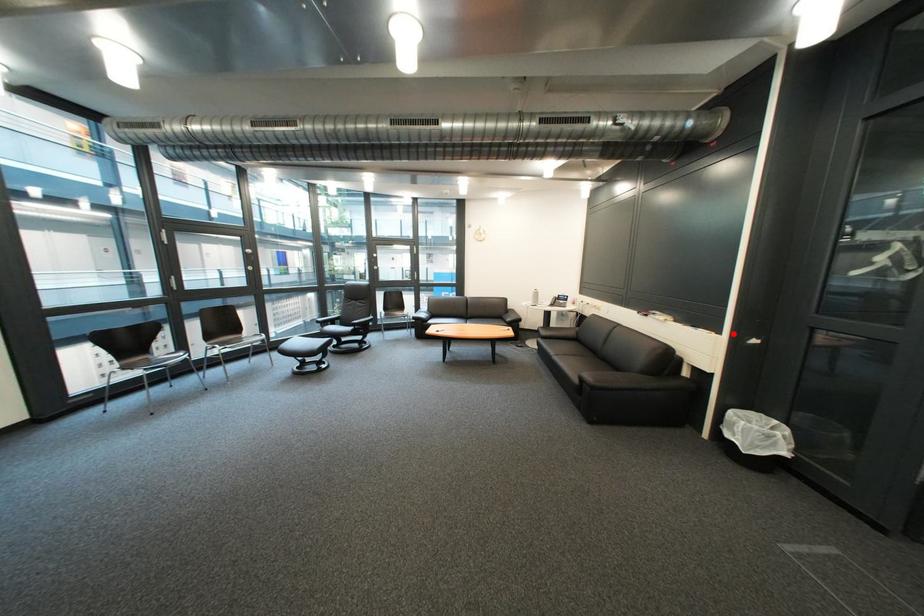
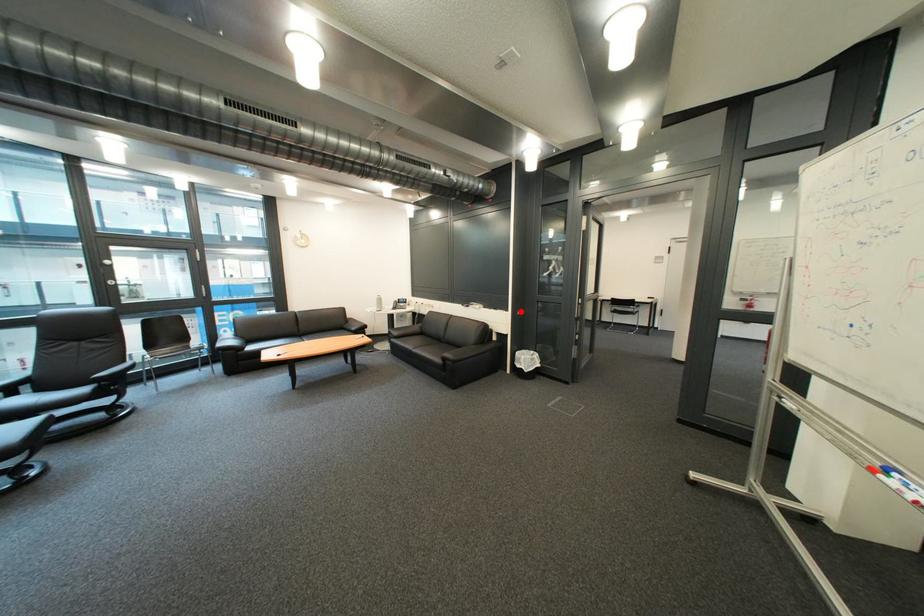
I am providing you with two images of the same scene from different viewpoints. A red point is marked on the first image and another point is marked on the second image. Is the red point in image1 aligned with the point shown in image2?

Yes